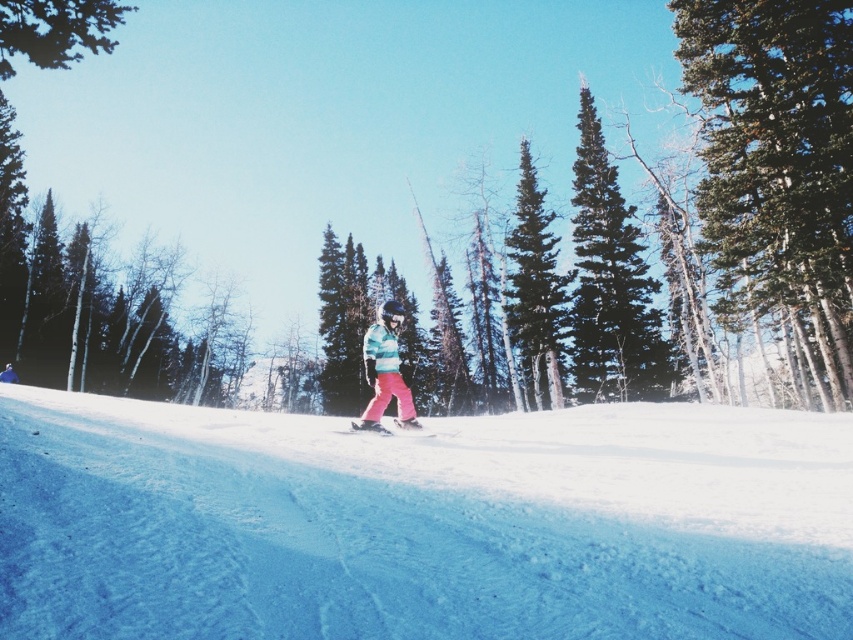
Is point (612, 180) in front of point (403, 312)?

No, it is not.

Where is `green coniferous tree at center`? green coniferous tree at center is located at coordinates pos(610,280).

Does green coniferous tree at center have a lesser width compared to pink fabric ski at center?

No.

Can you confirm if green coniferous tree at center is taller than pink fabric ski at center?

Indeed, green coniferous tree at center has a greater height compared to pink fabric ski at center.

At what (x,y) coordinates should I click in order to perform the action: click on green coniferous tree at center. Please return your answer as a coordinate pair (x, y). Image resolution: width=853 pixels, height=640 pixels. Looking at the image, I should click on (610, 280).

From the picture: Between white snow at center and green textured pine tree at upper right, which one appears on the right side from the viewer's perspective?

green textured pine tree at upper right is more to the right.

Measure the distance between point [602,604] and camera.

A distance of 10.26 feet exists between point [602,604] and camera.

Locate an element on the screen. This screenshot has height=640, width=853. white snow at center is located at coordinates (422, 524).